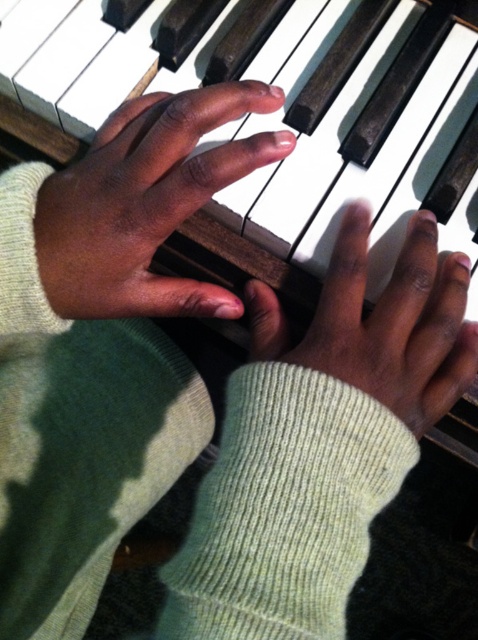
Who is shorter, dark skin hand at upper center or smooth skin hand at center?

smooth skin hand at center is shorter.

Does dark skin hand at upper center lie behind smooth skin hand at center?

That is True.

Does point (65, 260) come farther from viewer compared to point (406, 385)?

No, (65, 260) is closer to viewer.

Where is `dark skin hand at upper center`? The height and width of the screenshot is (640, 478). dark skin hand at upper center is located at coordinates coord(145,202).